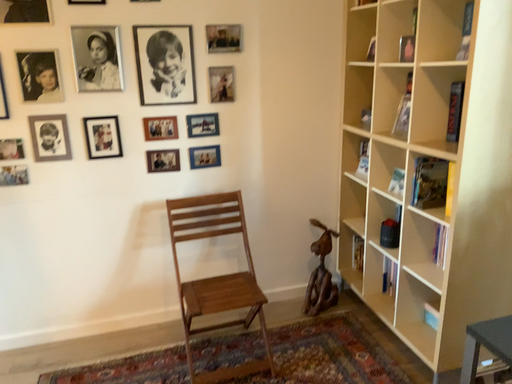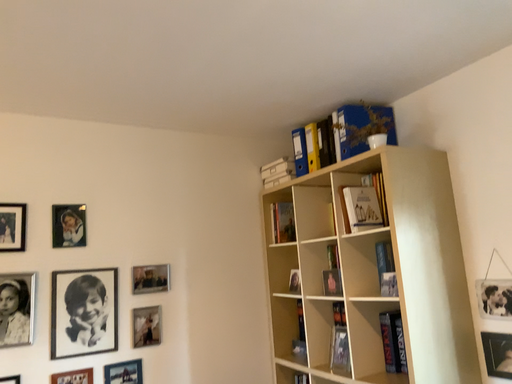
Question: Which way did the camera rotate in the video?

Choices:
 (A) rotated upward
 (B) rotated downward

Answer: (A)